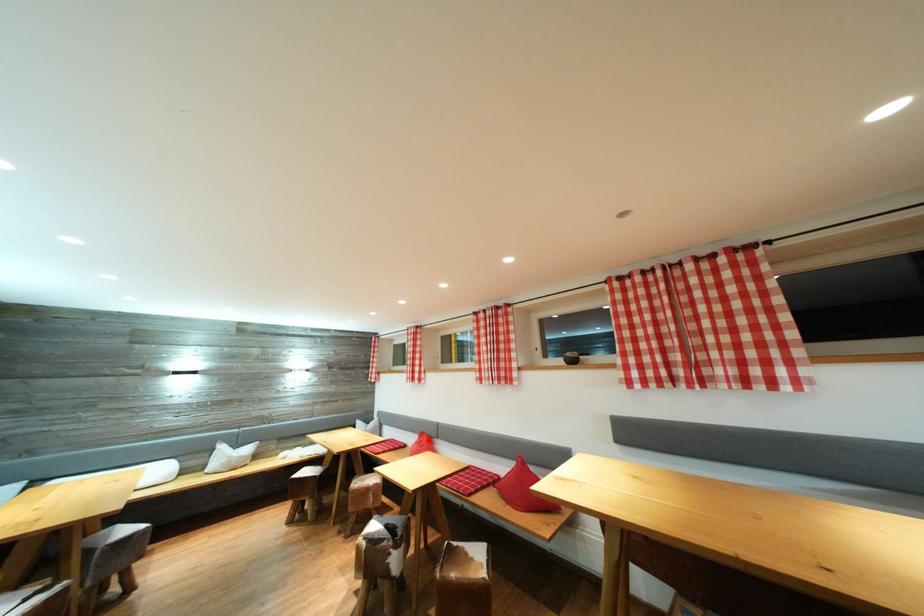
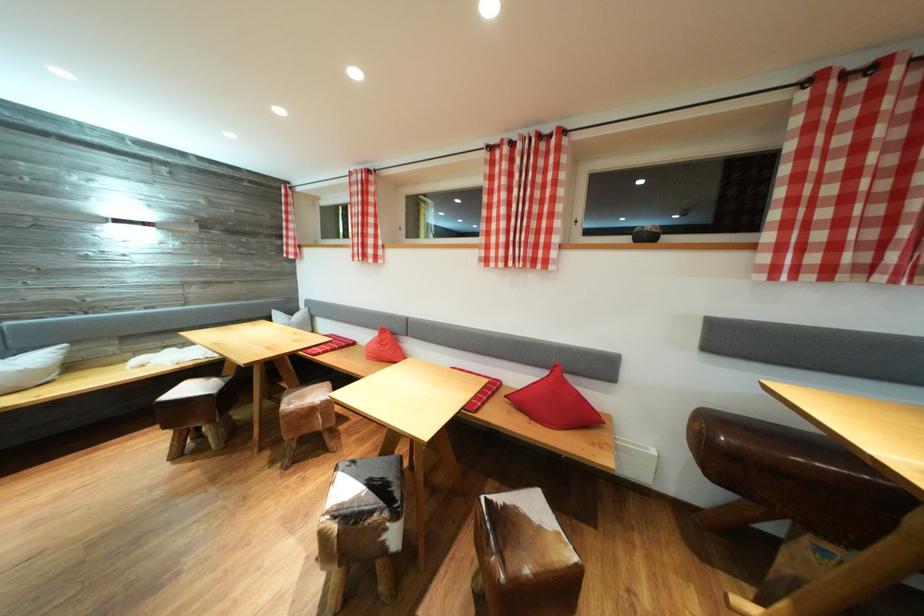
Locate, in the second image, the point that corresponds to the highlighted location in the first image.

(390, 336)